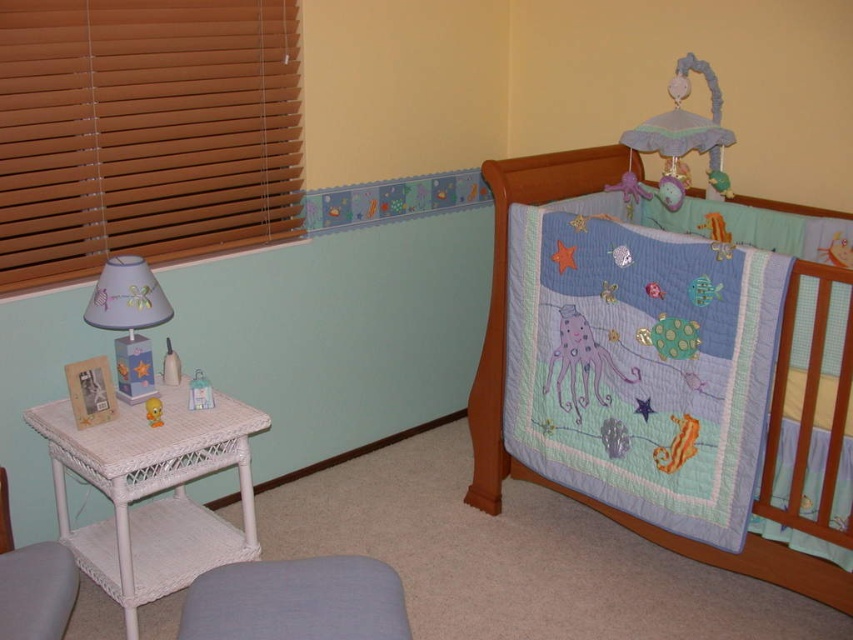
You are designing a nursery and want to ensure that the wooden blinds at left and the embroidered cotton crib quilt at upper right are proportionate. Given their sizes, which item takes up more space in the room?

The embroidered cotton crib quilt at upper right takes up more space than the wooden blinds at left because the wooden blinds at left occupies less space than embroidered cotton crib quilt at upper right.

You are a parent trying to place a new mobile above the crib. The mobile requires a mounting point that must be at least 1.2 meters away from the nearest wall. Given the position of the embroidered cotton crib quilt at upper right, can you determine if the mounting point at point (503, 387) is suitable?

The embroidered cotton crib quilt at upper right is represented by point (503, 387). Since the quilt is at this point, it indicates the crib is located there. The mounting point for the mobile must be at least 1.2 meters away from the nearest wall. However, without knowing the room dimensions or the distance from the crib to the walls, it is impossible to determine if the point meets the requirement. Please measure the distance from the crib to the nearest wall before installing the mobile.

You are a parent carrying a baby and want to move from the wooden blinds at left to the embroidered cotton crib quilt at upper right. Can you walk directly between them without needing to detour?

The wooden blinds at left is 1.10 meters away from embroidered cotton crib quilt at upper right. Since the distance is more than enough for a parent and baby to walk through, you can move directly between them without needing to detour.